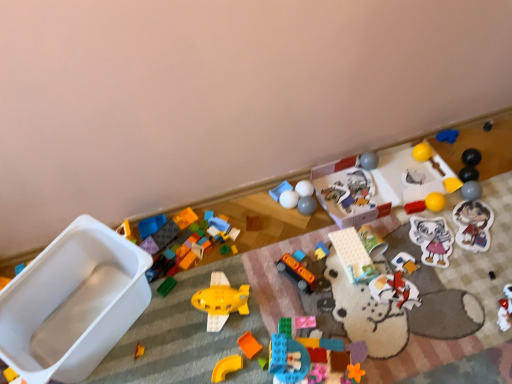
Find the location of a particular element. free space that is in between orange plastic block at lower left, which is the third toy in left-to-right order, and white glossy sticker at center-right, arranged as the twentieth toy when viewed from the left is located at coordinates (319, 288).